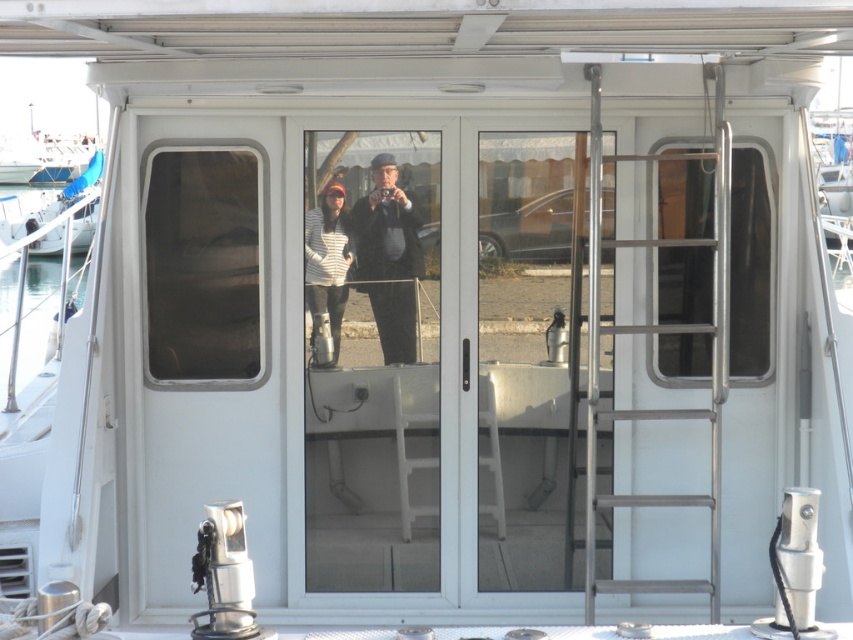
Question: Does striped sweater at center have a greater width compared to white glossy boat at left?

Choices:
 (A) yes
 (B) no

Answer: (B)

Question: Which object appears farthest from the camera in this image?

Choices:
 (A) matte black camera at center
 (B) striped sweater at center

Answer: (B)

Question: Which is nearer to the striped sweater at center?

Choices:
 (A) white glossy boat at left
 (B) matte black camera at center

Answer: (B)

Question: Which object is farther from the camera taking this photo?

Choices:
 (A) matte black camera at center
 (B) white glossy boat at left

Answer: (B)

Question: Is matte black camera at center smaller than white glossy boat at left?

Choices:
 (A) no
 (B) yes

Answer: (B)

Question: Is matte black camera at center further to the viewer compared to white glossy boat at left?

Choices:
 (A) yes
 (B) no

Answer: (B)